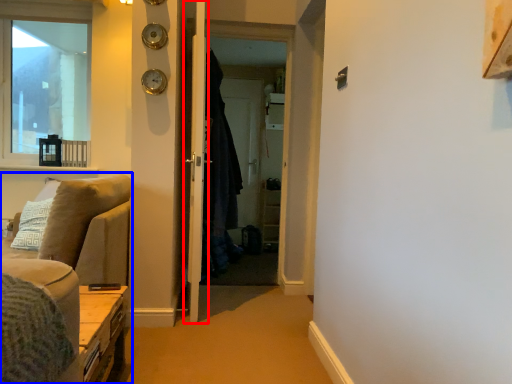
Question: Which of the following is the closest to the observer, door (highlighted by a red box) or studio couch (highlighted by a blue box)?

Choices:
 (A) door
 (B) studio couch

Answer: (B)